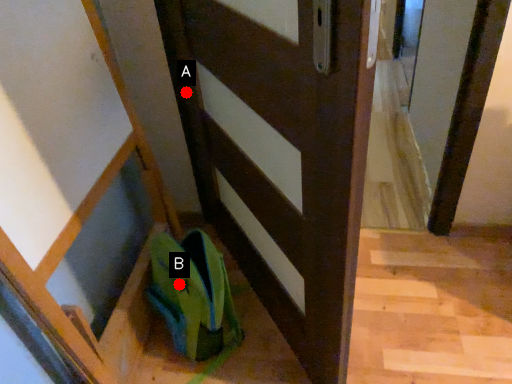
Question: Two points are circled on the image, labeled by A and B beside each circle. Which point appears closest to the camera in this image?

Choices:
 (A) A is closer
 (B) B is closer

Answer: (B)